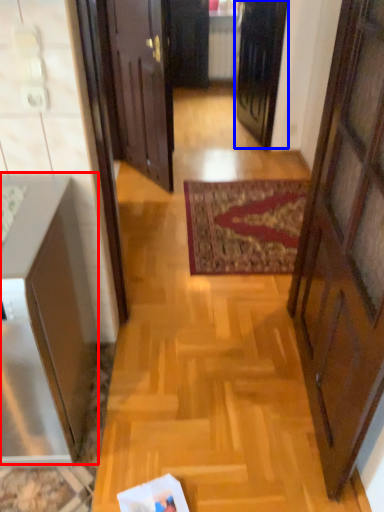
Question: Among these objects, which one is farthest to the camera, cabinetry (highlighted by a red box) or door (highlighted by a blue box)?

Choices:
 (A) cabinetry
 (B) door

Answer: (B)